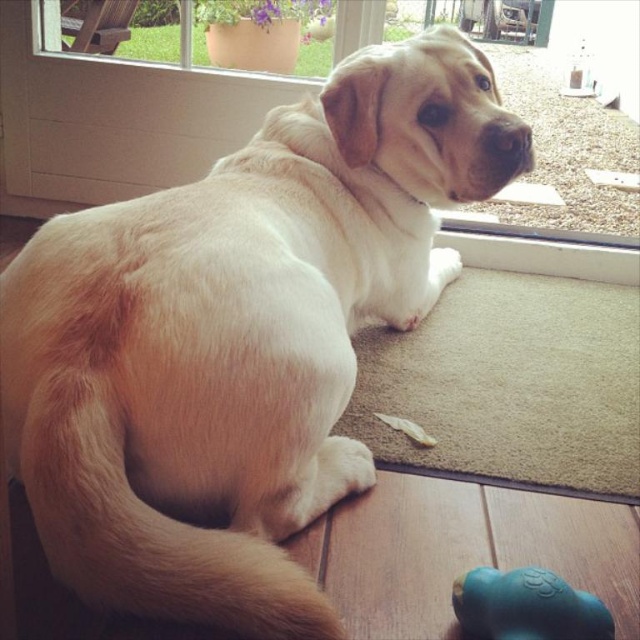
Measure the distance between point [627,140] and camera.

Point [627,140] and camera are 9.23 feet apart.

Is transparent glass window at upper center wider than teal rubber dog toy at lower right?

Correct, the width of transparent glass window at upper center exceeds that of teal rubber dog toy at lower right.

Is point (138, 118) behind point (584, 620)?

Yes, point (138, 118) is farther from viewer.

The image size is (640, 640). Find the location of `transparent glass window at upper center`. transparent glass window at upper center is located at coordinates (124, 104).